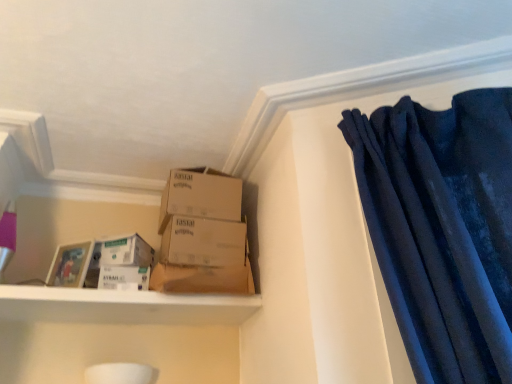
Question: Based on their sizes in the image, would you say brown cardboard box at center is bigger or smaller than white matte shelf at lower left?

Choices:
 (A) small
 (B) big

Answer: (A)

Question: Visually, is brown cardboard box at center positioned to the left or to the right of white matte shelf at lower left?

Choices:
 (A) left
 (B) right

Answer: (B)

Question: Estimate the real-world distances between objects in this image. Which object is farther from the cardboard boxes at upper center, which ranks as the 2th box in bottom-to-top order?

Choices:
 (A) brown cardboard box at center, the second box from the top
 (B) white cardboard box at lower left, marked as the first storage box in a bottom-to-top arrangement
 (C) brown cardboard box at center
 (D) velvet dark blue curtain at upper right
 (E) white cardboard box at lower left, placed as the 2th storage box when sorted from bottom to top

Answer: (D)

Question: Based on their relative distances, which object is farther from the brown cardboard box at center, the second box from the top?

Choices:
 (A) velvet dark blue curtain at upper right
 (B) cardboard boxes at upper center, which ranks as the 2th box in bottom-to-top order
 (C) white cardboard box at lower left, marked as the first storage box in a bottom-to-top arrangement
 (D) brown cardboard box at center
 (E) white cardboard box at lower left, which is the 1th storage box in top-to-bottom order

Answer: (A)